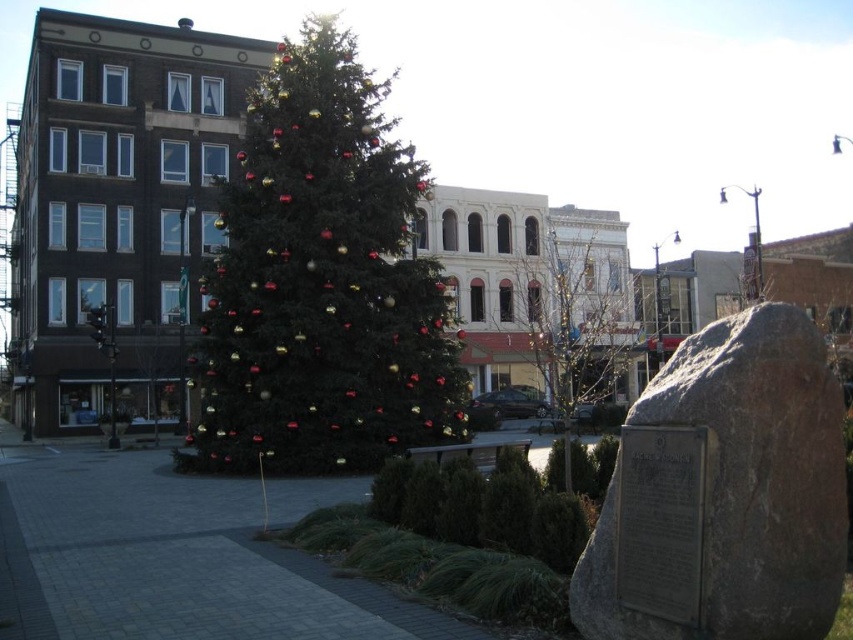
Can you confirm if gray rock at center is positioned to the left of green textured tree at center?

Indeed, gray rock at center is positioned on the left side of green textured tree at center.

The height and width of the screenshot is (640, 853). What do you see at coordinates (763, 468) in the screenshot?
I see `gray rock at center` at bounding box center [763, 468].

Between point (763, 417) and point (514, 307), which one is positioned in front?

Point (763, 417) is more forward.

Identify the location of gray rock at center. The image size is (853, 640). (763, 468).

Is green matte christmas tree at center smaller than green textured tree at center?

Yes.

Is green matte christmas tree at center wider than green textured tree at center?

No, green matte christmas tree at center is not wider than green textured tree at center.

The height and width of the screenshot is (640, 853). Identify the location of green matte christmas tree at center. (321, 284).

Between green matte christmas tree at center and gray rock at center, which one appears on the left side from the viewer's perspective?

From the viewer's perspective, green matte christmas tree at center appears more on the left side.

Is green matte christmas tree at center to the right of gray rock at center from the viewer's perspective?

Incorrect, green matte christmas tree at center is not on the right side of gray rock at center.

At what (x,y) coordinates should I click in order to perform the action: click on green matte christmas tree at center. Please return your answer as a coordinate pair (x, y). Looking at the image, I should click on (321, 284).